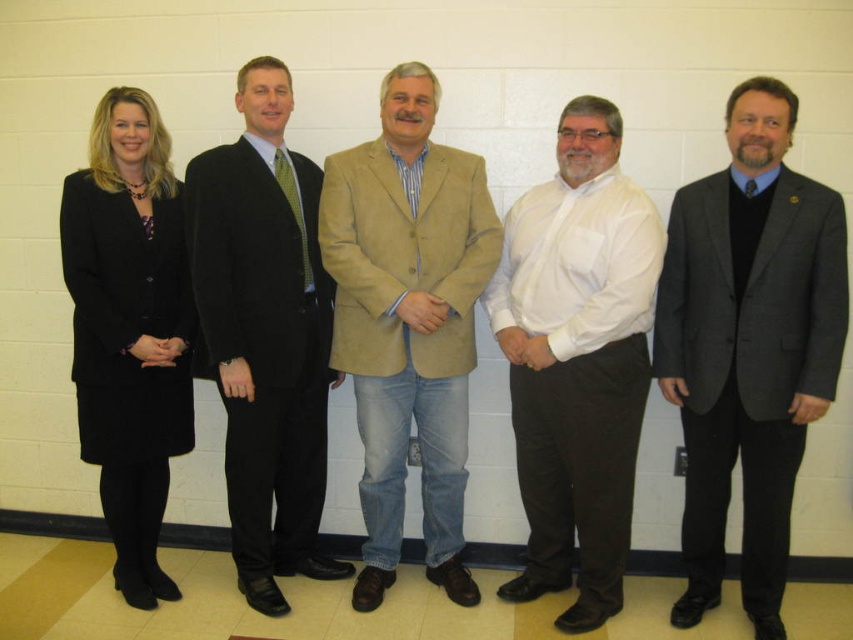
Does point (587, 211) lie behind point (178, 218)?

No, it is in front of (178, 218).

Which of these two, white shirt at center or black fabric suit at left, stands taller?

black fabric suit at left is taller.

In order to click on white shirt at center in this screenshot , I will do `click(577, 358)`.

Between point (740, 308) and point (573, 339), which one is positioned behind?

Point (740, 308)

Can you confirm if gray wool suit at center is positioned to the left of white shirt at center?

No, gray wool suit at center is not to the left of white shirt at center.

The height and width of the screenshot is (640, 853). I want to click on gray wool suit at center, so click(x=747, y=346).

I want to click on white shirt at center, so click(x=577, y=358).

From the picture: Who is more distant from viewer, (555, 244) or (442, 433)?

The point (442, 433) is more distant.

Image resolution: width=853 pixels, height=640 pixels. Identify the location of white shirt at center. (577, 358).